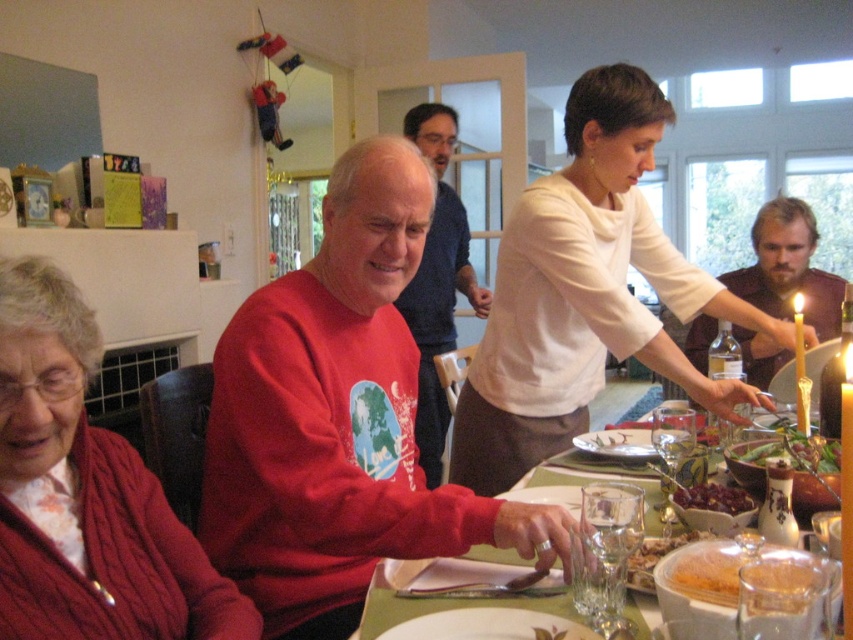
What object is located at the coordinates point (437, 282) in the image?

The point (437, 282) indicates the red sweater at center.

You are sitting at the dining table and want to pass the white ceramic plate at lower center to the person wearing the cabled knit sweater at left. Which direction should you move the plate to reach them?

The cabled knit sweater at left is positioned on the left side of the white ceramic plate at lower center, so you should move the plate to the left to reach the person wearing the cabled knit sweater at left.

You are a photographer at a family gathering. You need to position yourself so that you can capture both the white matte shirt at center and the cabled knit sweater at left in the same frame. Based on their positions, which side of the table should you stand on to ensure both are visible?

You should stand on the side of the table opposite to where the white matte shirt at center and cabled knit sweater at left are positioned. Since the white matte shirt at center is to the right of the cabled knit sweater at left, positioning yourself across from them would allow both to be in the frame.